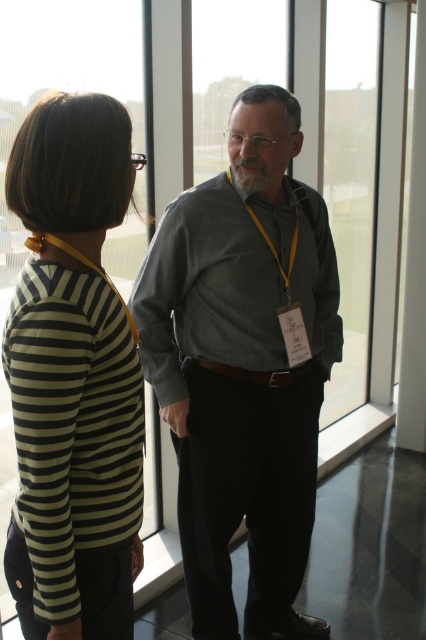
You are standing in the room and want to greet both people. Which person should you approach first if you want to greet the person wearing the striped fabric shirt at left before the gray cotton shirt at center?

You should approach the striped fabric shirt at left first since it is to the left of the gray cotton shirt at center, so it is closer on the left side.

You are a photographer setting up a shoot in this room. You need to position a spotlight so that it illuminates both the gray matte shirt at center and the gray cotton shirt at center equally. Considering their heights, which shirt should the spotlight be angled higher to reach?

The spotlight should be angled higher to reach the gray matte shirt at center because it is much taller than the gray cotton shirt at center.

You are organizing a photo shoot and need to ensure that the striped fabric shirt at left and the gray cotton shirt at center are visible in the frame. Based on their sizes, which shirt might require more careful framing to ensure it doesn not get lost in the background?

The striped fabric shirt at left occupies less space than the gray cotton shirt at center, so the striped fabric shirt at left might require more careful framing to ensure it doesn not get lost in the background.